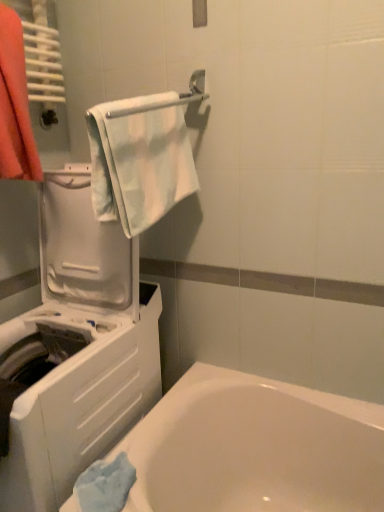
Measure the distance between point (x=176, y=191) and camera.

A distance of 4.17 feet exists between point (x=176, y=191) and camera.

Describe the element at coordinates (75, 351) in the screenshot. I see `white plastic washing machine at left` at that location.

I want to click on orange cotton towel at left, so click(x=15, y=104).

This screenshot has height=512, width=384. Find the location of `white glossy towel bar at upper center`. white glossy towel bar at upper center is located at coordinates (168, 99).

The image size is (384, 512). Identify the location of light blue fabric towel at upper center. (140, 159).

Considering the relative sizes of white glossy bathtub at lower left and orange cotton towel at left in the image provided, is white glossy bathtub at lower left taller than orange cotton towel at left?

Yes, white glossy bathtub at lower left is taller than orange cotton towel at left.

Considering the relative sizes of white glossy bathtub at lower left and orange cotton towel at left in the image provided, is white glossy bathtub at lower left thinner than orange cotton towel at left?

In fact, white glossy bathtub at lower left might be wider than orange cotton towel at left.

Is white glossy bathtub at lower left oriented towards orange cotton towel at left?

No, white glossy bathtub at lower left is not aimed at orange cotton towel at left.

From a real-world perspective, is white glossy bathtub at lower left physically above orange cotton towel at left?

No.

In the scene shown: From the image's perspective, is orange cotton towel at left located beneath white plastic washing machine at left?

Incorrect, from the image's perspective, orange cotton towel at left is higher than white plastic washing machine at left.

Considering the relative positions of orange cotton towel at left and white plastic washing machine at left in the image provided, is orange cotton towel at left to the right of white plastic washing machine at left from the viewer's perspective?

Incorrect, orange cotton towel at left is not on the right side of white plastic washing machine at left.

In terms of height, does orange cotton towel at left look taller or shorter compared to white plastic washing machine at left?

Considering their sizes, orange cotton towel at left has less height than white plastic washing machine at left.

Can you tell me how much light blue fabric towel at upper center and orange cotton towel at left differ in facing direction?

light blue fabric towel at upper center and orange cotton towel at left are facing 7.54e-05 degrees away from each other.

You are a GUI agent. You are given a task and a screenshot of the screen. Output one action in this format:
    pyautogui.click(x=<x>, y=<y>)
    Task: Click on the towel/napkin lying on the right of orange cotton towel at left
    This screenshot has height=512, width=384.
    Given the screenshot: What is the action you would take?
    pyautogui.click(x=140, y=159)

Is orange cotton towel at left surrounded by light blue fabric towel at upper center?

No.

Does point (139, 125) lie in front of point (8, 21)?

Yes.

Is white glossy towel bar at upper center surrounding white plastic washing machine at left?

No, white plastic washing machine at left is not inside white glossy towel bar at upper center.

Does white glossy towel bar at upper center have a lesser width compared to white plastic washing machine at left?

Yes, white glossy towel bar at upper center is thinner than white plastic washing machine at left.

Is white glossy towel bar at upper center taller or shorter than white plastic washing machine at left?

Clearly, white glossy towel bar at upper center is shorter compared to white plastic washing machine at left.

Considering the sizes of white plastic washing machine at left and white glossy bathtub at lower left in the image, is white plastic washing machine at left taller or shorter than white glossy bathtub at lower left?

Clearly, white plastic washing machine at left is taller compared to white glossy bathtub at lower left.

From the image's perspective, is white plastic washing machine at left above or below white glossy bathtub at lower left?

white plastic washing machine at left is above white glossy bathtub at lower left.

Is white plastic washing machine at left turned away from white glossy bathtub at lower left?

white plastic washing machine at left is not turned away from white glossy bathtub at lower left.

Considering the positions of objects white plastic washing machine at left and white glossy bathtub at lower left in the image provided, who is more to the right, white plastic washing machine at left or white glossy bathtub at lower left?

From the viewer's perspective, white glossy bathtub at lower left appears more on the right side.

From the image's perspective, is white glossy bathtub at lower left above light blue fabric towel at upper center?

Actually, white glossy bathtub at lower left appears below light blue fabric towel at upper center in the image.

From a real-world perspective, is white glossy bathtub at lower left under light blue fabric towel at upper center?

Correct, in the physical world, white glossy bathtub at lower left is lower than light blue fabric towel at upper center.

Based on the photo, is white glossy bathtub at lower left beside light blue fabric towel at upper center?

No, white glossy bathtub at lower left is not next to light blue fabric towel at upper center.

Is light blue fabric towel at upper center positioned with its back to white glossy bathtub at lower left?

No, light blue fabric towel at upper center is not facing away from white glossy bathtub at lower left.

Consider the image. Does light blue fabric towel at upper center lie behind white glossy bathtub at lower left?

Result: Yes, light blue fabric towel at upper center is further from the camera.

From the image's perspective, does light blue fabric towel at upper center appear higher than white glossy bathtub at lower left?

Indeed, from the image's perspective, light blue fabric towel at upper center is shown above white glossy bathtub at lower left.

At what (x,y) coordinates should I click in order to perform the action: click on bathtub below the light blue fabric towel at upper center (from the image's perspective). Please return your answer as a coordinate pair (x, y). Looking at the image, I should click on (255, 447).

Locate an element on the screen. bathtub that appears in front of the orange cotton towel at left is located at coordinates (255, 447).

Where is `laundry on the left of white plastic washing machine at left`? This screenshot has width=384, height=512. laundry on the left of white plastic washing machine at left is located at coordinates (15, 104).

Looking at the image, which one is located further to white glossy bathtub at lower left, orange cotton towel at left or white glossy towel bar at upper center?

white glossy towel bar at upper center is further to white glossy bathtub at lower left.

From the image, which object appears to be farther from white glossy towel bar at upper center, orange cotton towel at left or white plastic washing machine at left?

white plastic washing machine at left lies further to white glossy towel bar at upper center than the other object.

From the image, which object appears to be nearer to white glossy bathtub at lower left, white plastic washing machine at left or white glossy towel bar at upper center?

white plastic washing machine at left is closer to white glossy bathtub at lower left.

Which object lies further to the anchor point white glossy bathtub at lower left, light blue fabric towel at upper center or white plastic washing machine at left?

light blue fabric towel at upper center is positioned further to the anchor white glossy bathtub at lower left.

Considering their positions, is white plastic washing machine at left positioned closer to orange cotton towel at left than light blue fabric towel at upper center?

The object closer to orange cotton towel at left is light blue fabric towel at upper center.

When comparing their distances from white glossy towel bar at upper center, does white glossy bathtub at lower left or light blue fabric towel at upper center seem further?

white glossy bathtub at lower left is positioned further to the anchor white glossy towel bar at upper center.

Based on their spatial positions, is white glossy towel bar at upper center or orange cotton towel at left closer to white glossy bathtub at lower left?

Answer: The object closer to white glossy bathtub at lower left is orange cotton towel at left.

Considering their positions, is light blue fabric towel at upper center positioned closer to white plastic washing machine at left than orange cotton towel at left?

light blue fabric towel at upper center is closer to white plastic washing machine at left.

Identify the location of washing machine between light blue fabric towel at upper center and white glossy bathtub at lower left vertically. (75, 351).

This screenshot has height=512, width=384. Identify the location of towel/napkin between orange cotton towel at left and white glossy towel bar at upper center. (140, 159).

This screenshot has height=512, width=384. What are the coordinates of `washing machine between orange cotton towel at left and white glossy bathtub at lower left in the up-down direction` in the screenshot? It's located at (75, 351).

Locate an element on the screen. towel/napkin between orange cotton towel at left and white glossy bathtub at lower left vertically is located at coordinates (140, 159).